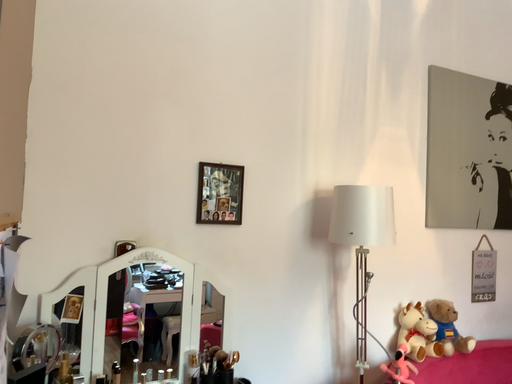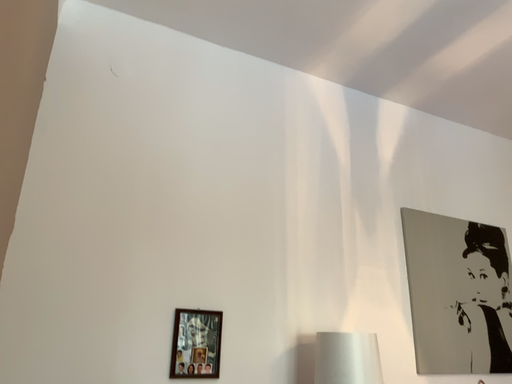
Question: How did the camera likely rotate when shooting the video?

Choices:
 (A) rotated upward
 (B) rotated downward

Answer: (A)